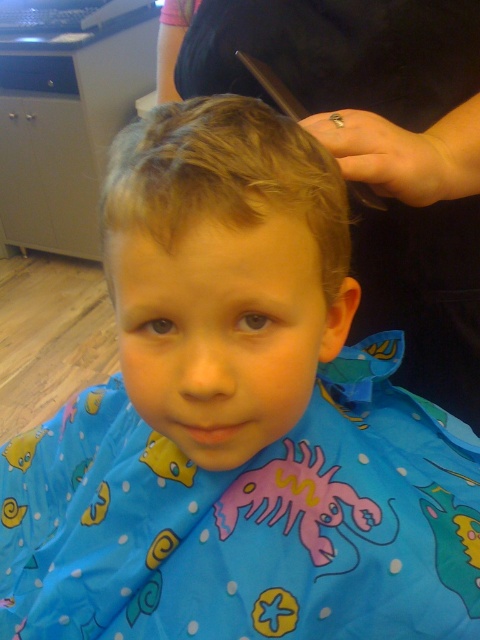
Question: Which point appears closest to the camera in this image?

Choices:
 (A) (444, 349)
 (B) (141, 177)

Answer: (B)

Question: Does black fabric at upper center have a smaller size compared to blonde smooth hair at center?

Choices:
 (A) yes
 (B) no

Answer: (B)

Question: Can you confirm if black fabric at upper center is thinner than blonde smooth hair at center?

Choices:
 (A) yes
 (B) no

Answer: (B)

Question: Can you confirm if black fabric at upper center is wider than blonde smooth hair at center?

Choices:
 (A) yes
 (B) no

Answer: (A)

Question: Which of the following is the farthest from the observer?

Choices:
 (A) (412, 58)
 (B) (269, 138)

Answer: (A)

Question: Which point appears closest to the camera in this image?

Choices:
 (A) (288, 148)
 (B) (272, 49)

Answer: (A)